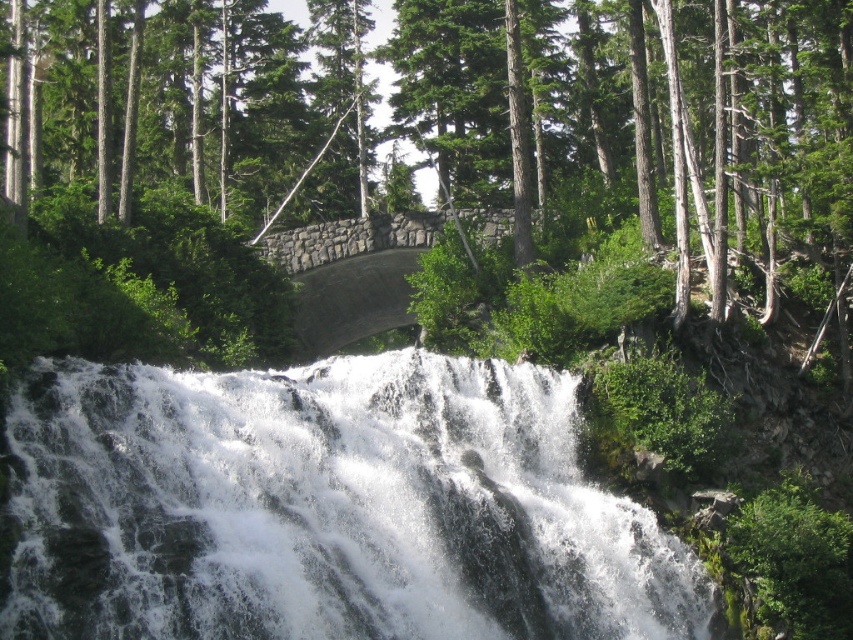
You are a hiker who wants to take a photo of the green leafy tree at center and the white frothy water at center. Which object will appear bigger in your camera viewfinder?

The green leafy tree at center will appear bigger in the camera viewfinder because it has a larger size compared to the white frothy water at center.

You are standing at the base of the waterfall and want to take a photo. There are two points marked in the scene. The first point is at coordinates point (809, 310) and the second point is at point (132, 564). Which point is closer to your camera lens?

Point (809, 310) is further to the camera than point (132, 564), so the second point is closer to the camera lens.

You are standing in front of the waterfall and want to take a photo of the green leafy tree at center. The camera you have can focus up to 200 feet. Will the tree be in focus?

The green leafy tree at center is 176.59 feet away from the viewer. Since the camera can focus up to 200 feet, the tree will be within the focus range and should appear sharp in the photo.